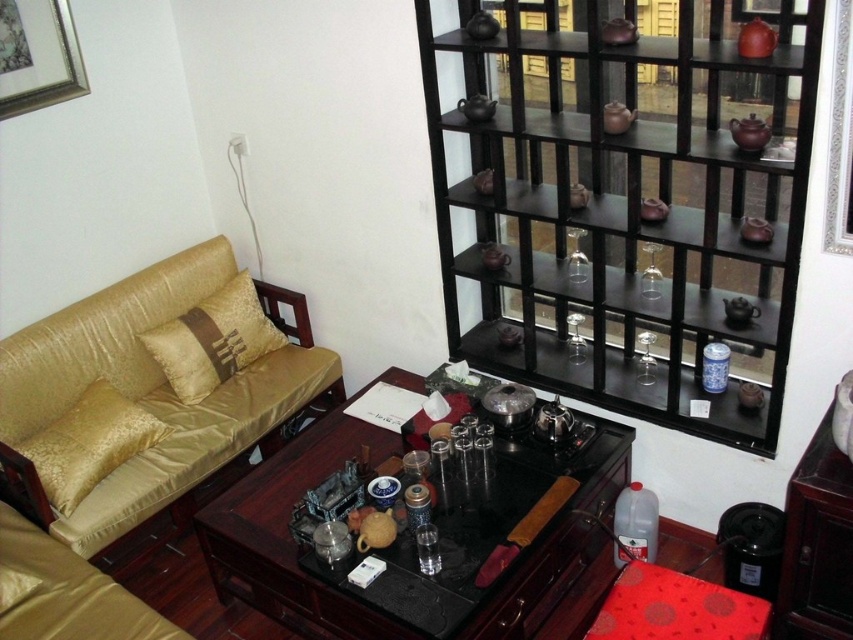
Who is positioned more to the left, black wood shelf at upper right or shiny dark wood table at center?

shiny dark wood table at center is more to the left.

Can you confirm if black wood shelf at upper right is wider than shiny dark wood table at center?

In fact, black wood shelf at upper right might be narrower than shiny dark wood table at center.

Between point (821, 6) and point (601, 433), which one is positioned in front?

Positioned in front is point (821, 6).

Where is `black wood shelf at upper right`? The height and width of the screenshot is (640, 853). black wood shelf at upper right is located at coordinates (627, 200).

Is point (503, 376) positioned before point (219, 317)?

Yes.

Between point (602, 352) and point (219, 348), which one is positioned in front?

Positioned in front is point (602, 352).

Find the location of a particular element. Image resolution: width=853 pixels, height=640 pixels. black wood shelf at upper right is located at coordinates (627, 200).

Between point (590, 490) and point (619, 492), which one is positioned behind?

Point (619, 492)

Locate an element on the screen. black glossy drawer at center is located at coordinates (556, 564).